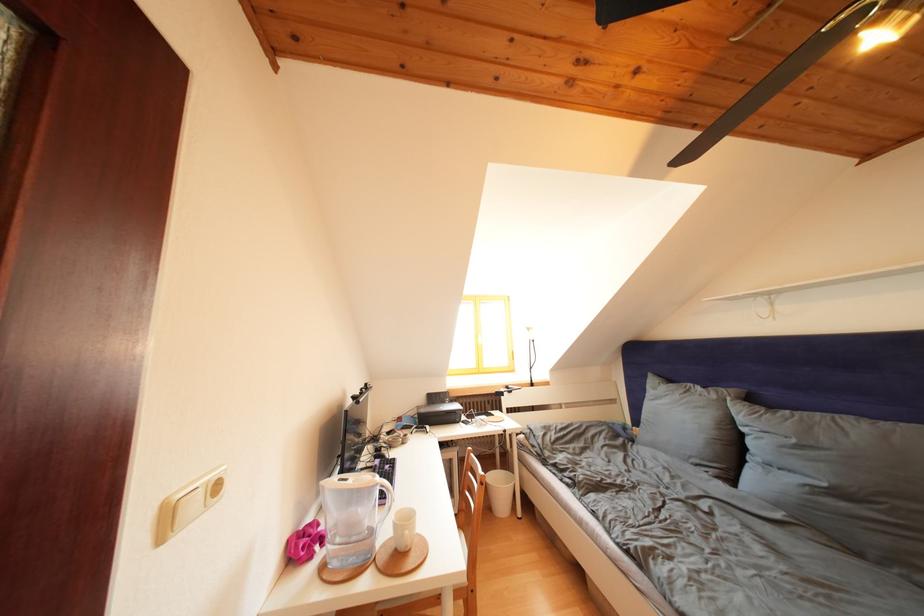
Describe the element at coordinates (353, 516) in the screenshot. I see `the white mug handle` at that location.